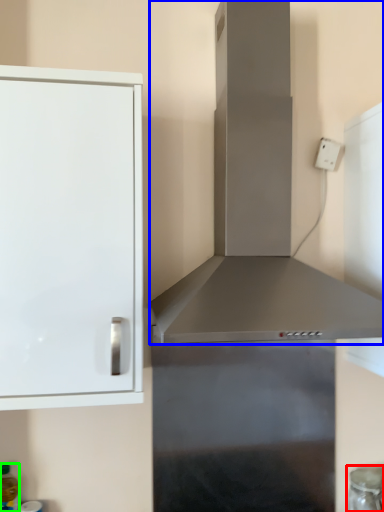
Question: Considering the real-world distances, which object is farthest from appliance (highlighted by a red box)? vent (highlighted by a blue box) or bottle (highlighted by a green box)?

Choices:
 (A) vent
 (B) bottle

Answer: (B)